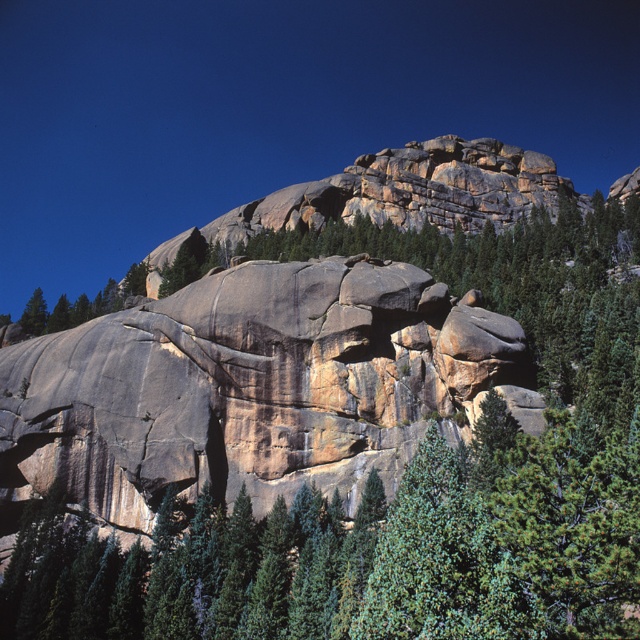
You are a geologist standing at the base of the rough granite rock at center. You need to reach the gray granite rock face at center to collect samples. Can you walk directly to it without any obstacles?

The distance between the rough granite rock at center and the gray granite rock face at center is 358.04 meters. Since there are no mentioned obstacles in the scene description, you can walk directly to it.

You are a geologist examining the dramatic natural landscape. You notice the rough granite rock at center and the gray granite rock face at center. Which of these two objects is taller?

The rough granite rock at center is much taller than the gray granite rock face at center.